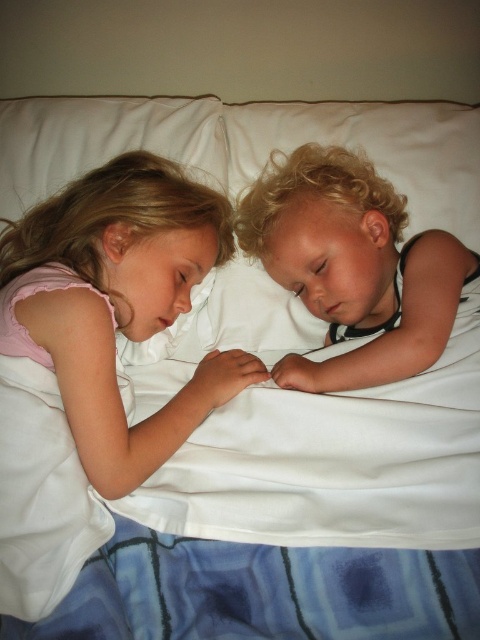
Question: Can you confirm if pink fabric dress at center is positioned to the right of smooth black shirt at right?

Choices:
 (A) yes
 (B) no

Answer: (B)

Question: Is the position of pink fabric dress at center more distant than that of smooth black shirt at right?

Choices:
 (A) yes
 (B) no

Answer: (B)

Question: Which object appears closest to the camera in this image?

Choices:
 (A) pink fabric dress at center
 (B) smooth black shirt at right

Answer: (A)

Question: Is pink fabric dress at center to the left of smooth black shirt at right from the viewer's perspective?

Choices:
 (A) no
 (B) yes

Answer: (B)